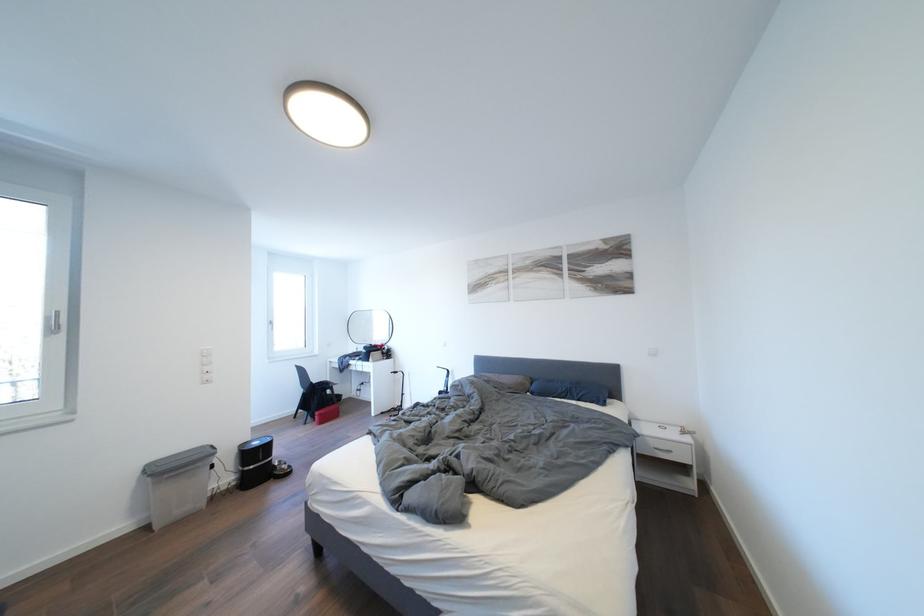
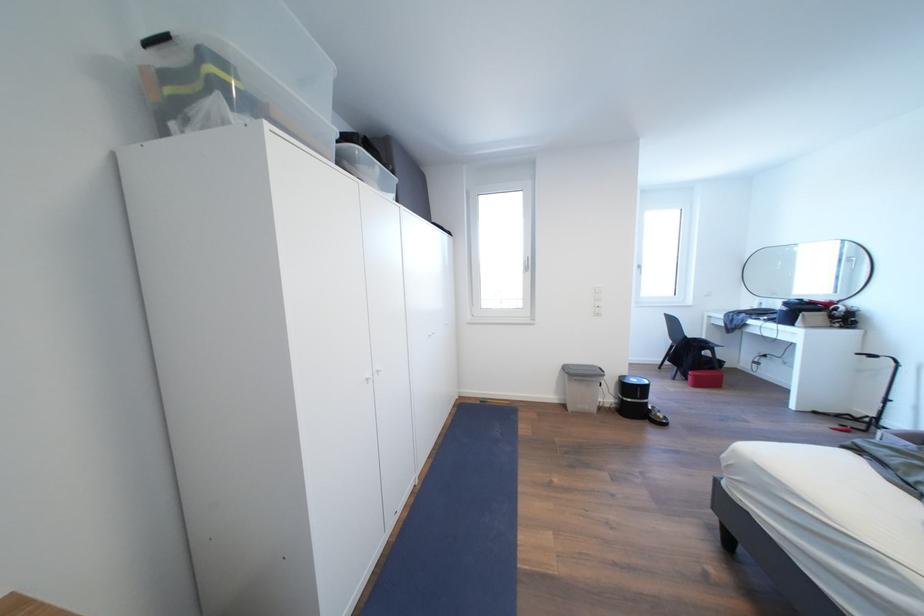
In the second image, find the point that corresponds to the point at 56,323 in the first image.

(532, 267)